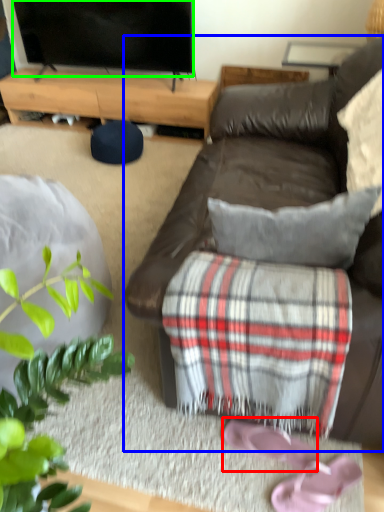
Question: Based on their relative distances, which object is nearer to shoe (highlighted by a red box)? Choose from studio couch (highlighted by a blue box) and television (highlighted by a green box).

Choices:
 (A) studio couch
 (B) television

Answer: (A)